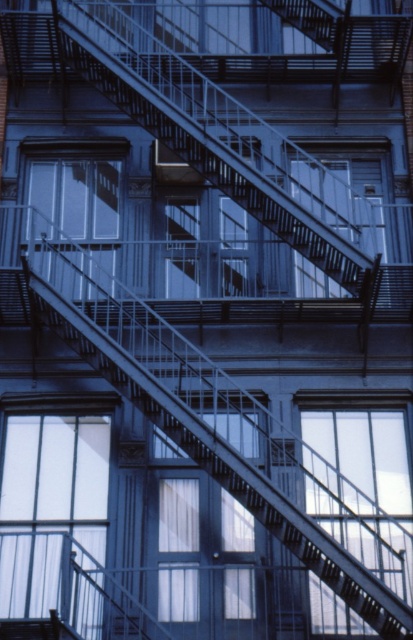
Question: Which point is farther to the camera?

Choices:
 (A) metallic gray stairwell at center
 (B) clear glass window at center
 (C) metallic staircase at center
 (D) metallic fire escape at upper center

Answer: (D)

Question: Among these points, which one is nearest to the camera?

Choices:
 (A) (334, 570)
 (B) (405, 572)
 (C) (230, 122)
 (D) (208, 40)

Answer: (A)

Question: Can you confirm if clear glass window at lower left is positioned above transparent glass window at center?

Choices:
 (A) yes
 (B) no

Answer: (B)

Question: Is metallic gray stairwell at center closer to camera compared to metallic staircase at center?

Choices:
 (A) no
 (B) yes

Answer: (B)

Question: Estimate the real-world distances between objects in this image. Which object is farther from the metallic fire escape at upper center?

Choices:
 (A) transparent glass window at center
 (B) clear glass window at lower left
 (C) metallic gray stairwell at center
 (D) metallic staircase at center

Answer: (B)

Question: In this image, where is metallic staircase at center located relative to transparent glass window at center?

Choices:
 (A) left
 (B) right

Answer: (B)